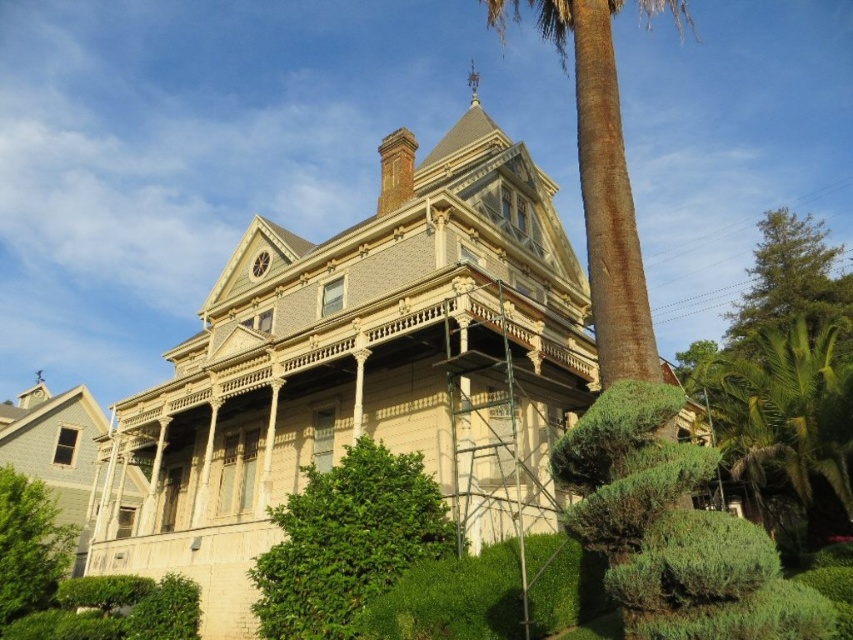
Question: Which object appears farthest from the camera in this image?

Choices:
 (A) green leafy bush at lower center
 (B) brown textured palm tree at center

Answer: (B)

Question: In this image, where is green leafy bush at lower center located relative to brown textured palm tree at center?

Choices:
 (A) below
 (B) above

Answer: (A)

Question: Among these points, which one is farthest from the camera?

Choices:
 (A) (345, 541)
 (B) (651, 332)

Answer: (A)

Question: Does green leafy bush at lower center come in front of brown textured palm tree at center?

Choices:
 (A) no
 (B) yes

Answer: (B)

Question: Can you confirm if green leafy bush at lower center is wider than brown textured palm tree at center?

Choices:
 (A) yes
 (B) no

Answer: (B)

Question: Among these objects, which one is nearest to the camera?

Choices:
 (A) green leafy bush at lower center
 (B) brown textured palm tree at center

Answer: (A)